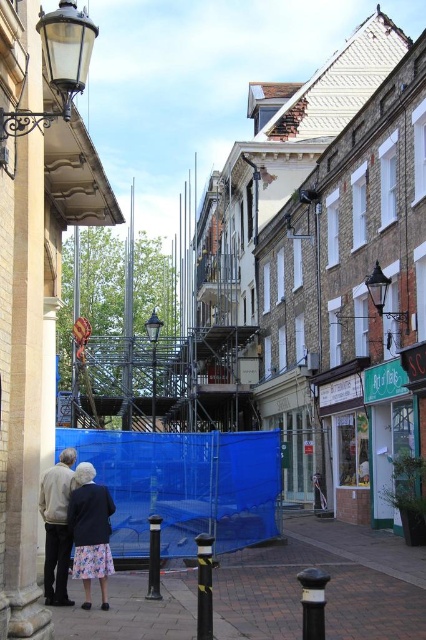
Question: Which is farther from the matte black lamp post at upper left?

Choices:
 (A) black/yellow striped pole at center
 (B) black polished metal pole at center
 (C) dark gray wool coat at center

Answer: (B)

Question: Can you confirm if brick pavement at lower center is positioned to the left of dark gray wool coat at center?

Choices:
 (A) yes
 (B) no

Answer: (B)

Question: Which object is positioned closest to the black/yellow striped pole at center?

Choices:
 (A) brick pavement at lower center
 (B) matte black lamp post at upper left

Answer: (A)

Question: Can you confirm if dark gray wool coat at center is thinner than black polished metal pole at center?

Choices:
 (A) no
 (B) yes

Answer: (A)

Question: Which point is farther to the camera?

Choices:
 (A) light gray sweater at lower left
 (B) black polished metal pole at center

Answer: (B)

Question: Is dark gray wool coat at center to the right of light gray sweater at lower left from the viewer's perspective?

Choices:
 (A) no
 (B) yes

Answer: (B)